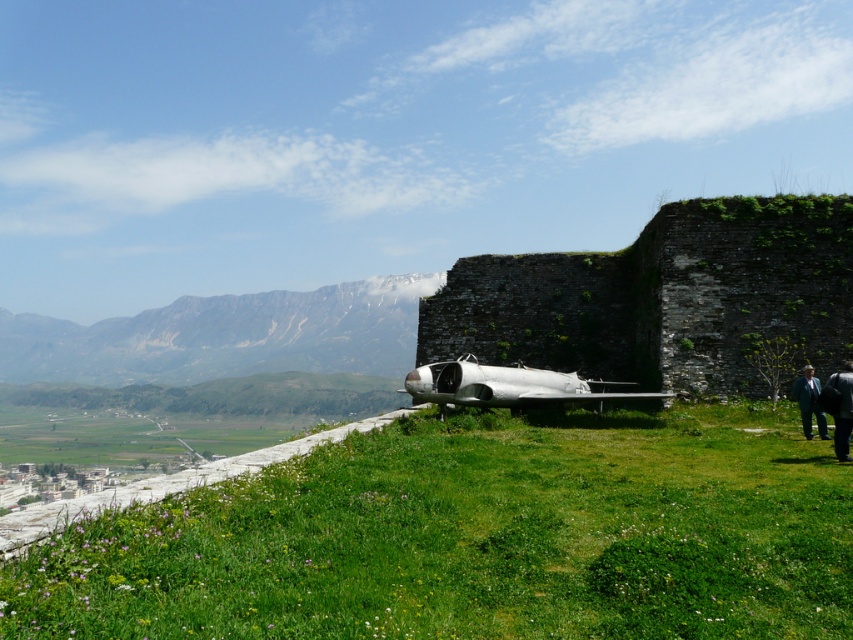
You are standing at the base of the grassy hilltop and looking up at the vintage aircraft and the stone wall. Which of the two points, point (727, 557) or point (621, 294), is closer to you?

Point (727, 557) is closer to the viewer than point (621, 294).

You are standing at the point with coordinates point (476, 538) and want to walk towards the vintage aircraft parked near a stone wall. Which direction should you go?

The point (476, 538) is located at the green grassy at lower center. Since the vintage aircraft is parked near the stone wall on the hilltop, you should walk upwards from the green grassy at lower center towards the higher elevation where the vintage aircraft is positioned.

Looking at this image, you are a hiker who wants to sit down on the green grassy at lower center. However, you are wearing the dark gray suit at lower right. Will your suit get dirty from the grass?

The green grassy at lower center is shorter than the dark gray suit at lower right, so the grass might not reach the suit, reducing the chance of it getting dirty.